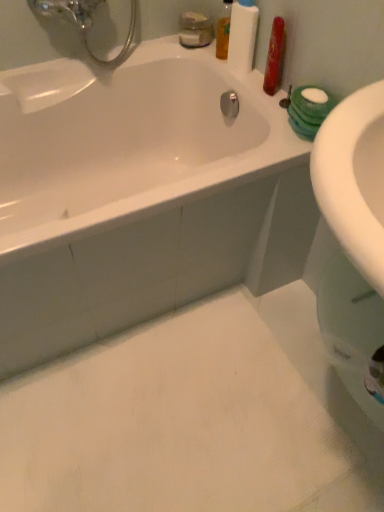
Identify the location of vacant space that is to the left of translucent plastic mouthwash at upper center, acting as the 1th mouthwash starting from the left. Image resolution: width=384 pixels, height=512 pixels. (153, 53).